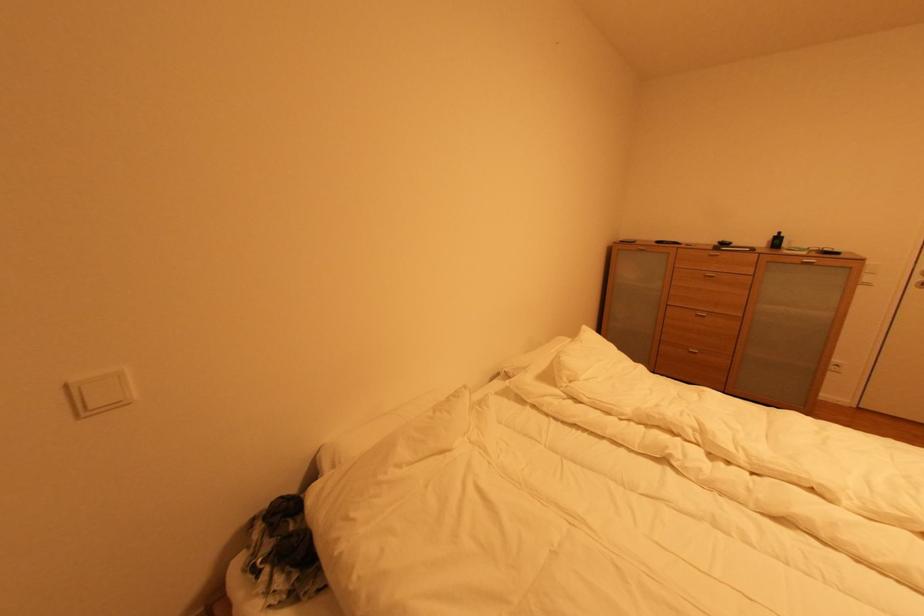
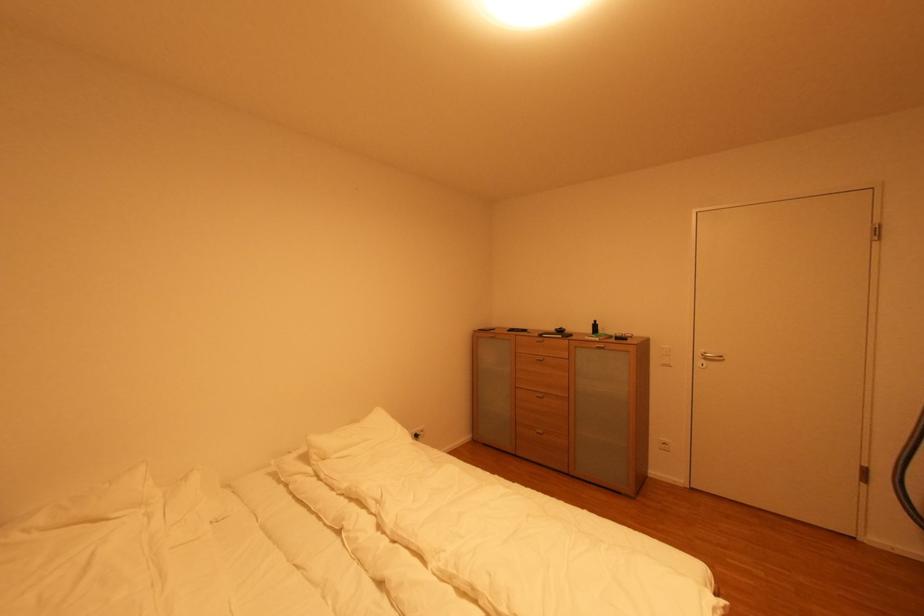
Find the pixel in the second image that matches point 845,254 in the first image.

(630, 339)